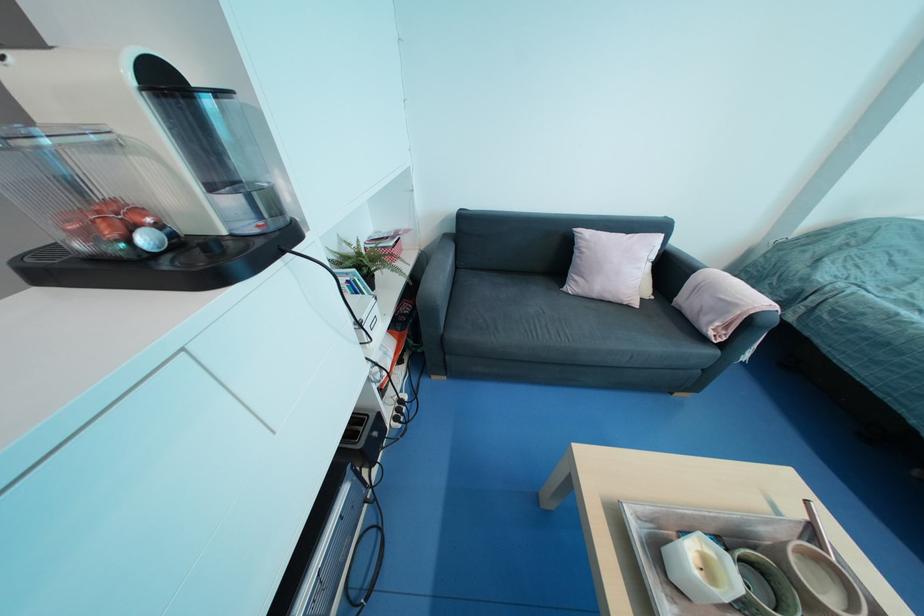
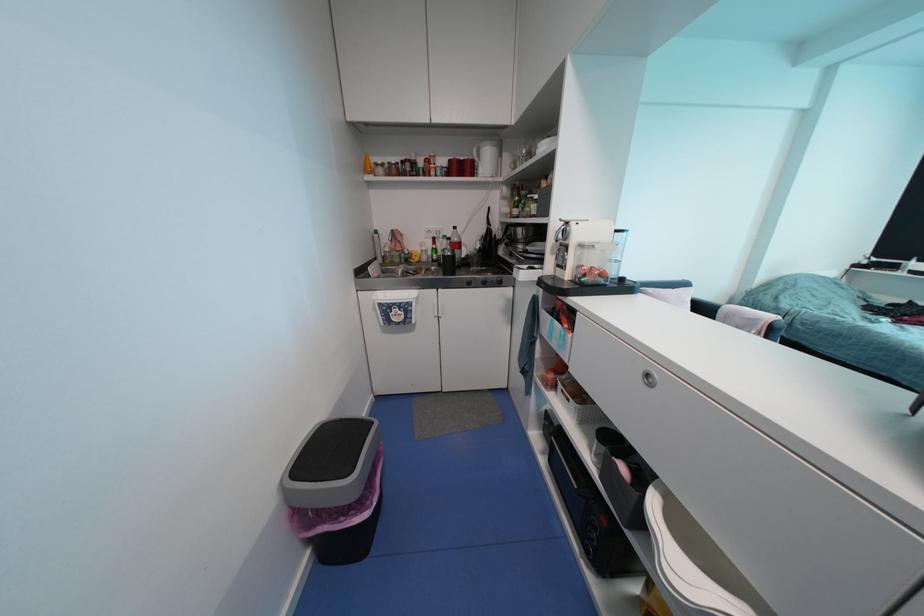
Which direction would the cameraman need to move to produce the second image?

Result: The cameraman moved toward left, backward.